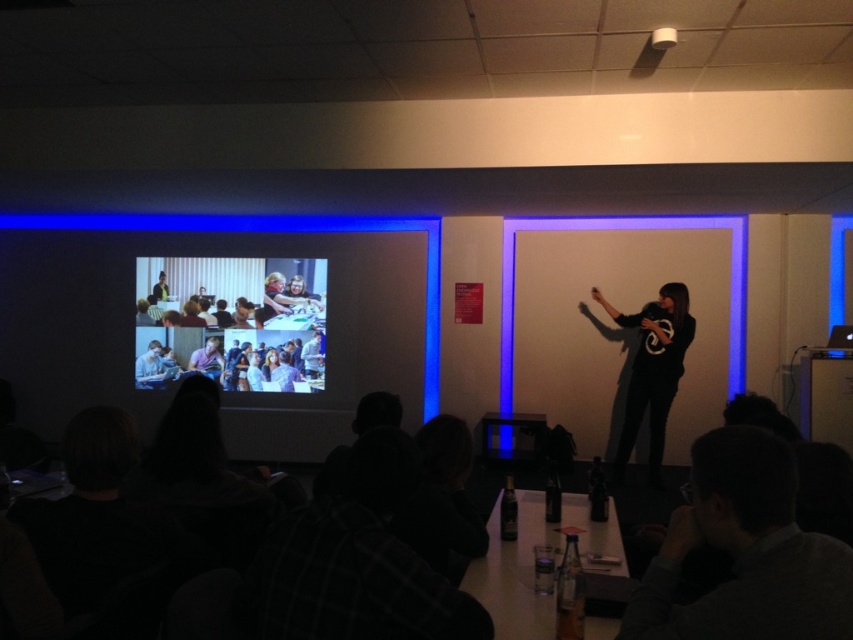
You are an attendee at this presentation. You want to see the presenter clearly while still viewing the projector screen. Is the black matte shirt at center visible through the matte plastic projector screen at center?

The black matte shirt at center is behind the matte plastic projector screen at center, so it cannot be seen through the screen.

You are an attendee at the presentation. You notice the matte plastic projector screen at center and the black matte shirt at center. Which object is closer to the left wall?

The matte plastic projector screen at center is closer to the left wall because it is positioned to the left of the black matte shirt at center.